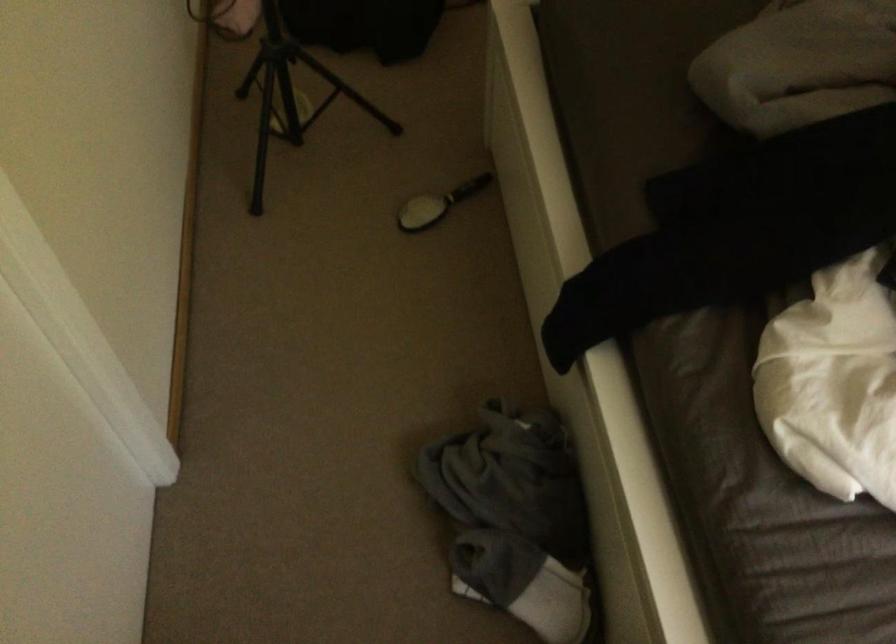
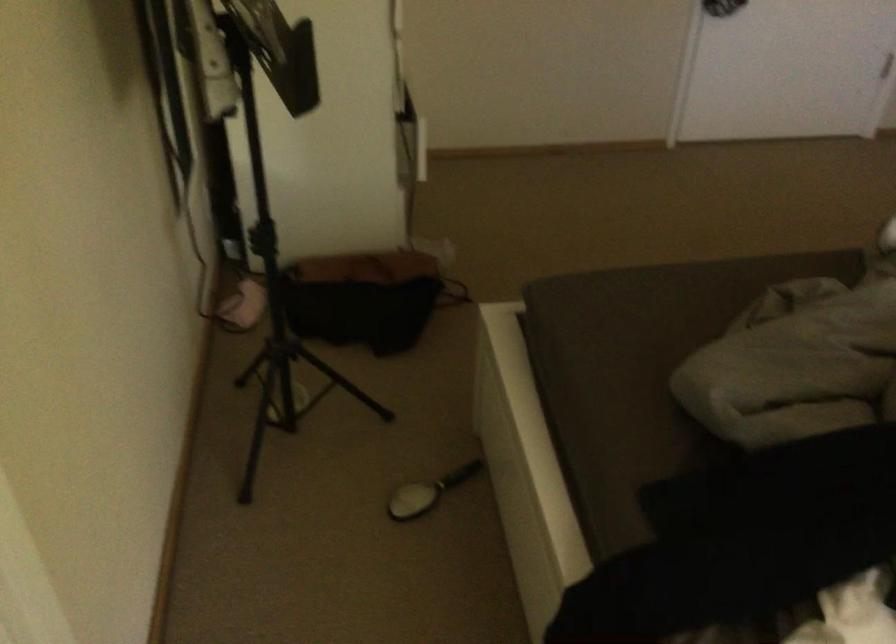
Looking at this image, what movement of the cameraman would produce the second image?

The movement direction of the cameraman is left, backward.